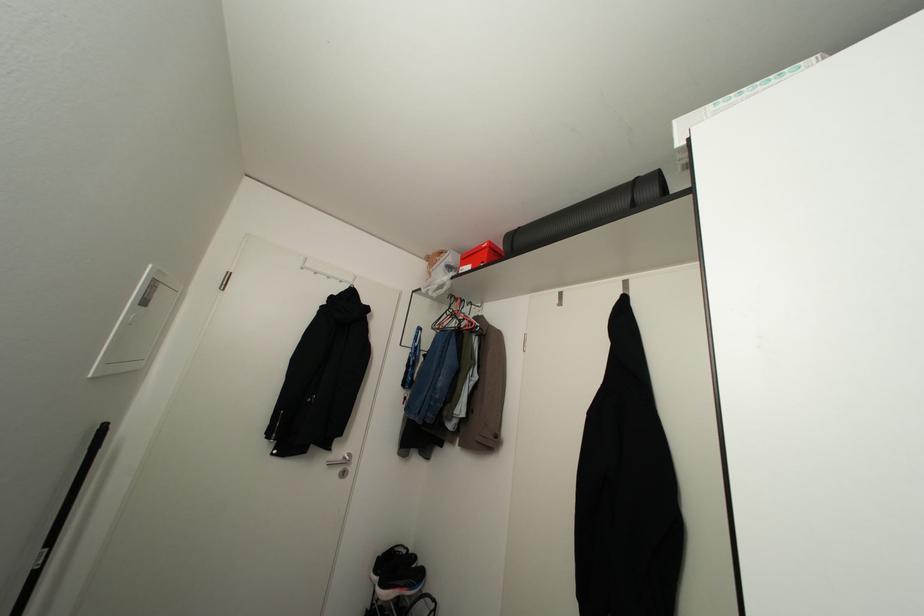
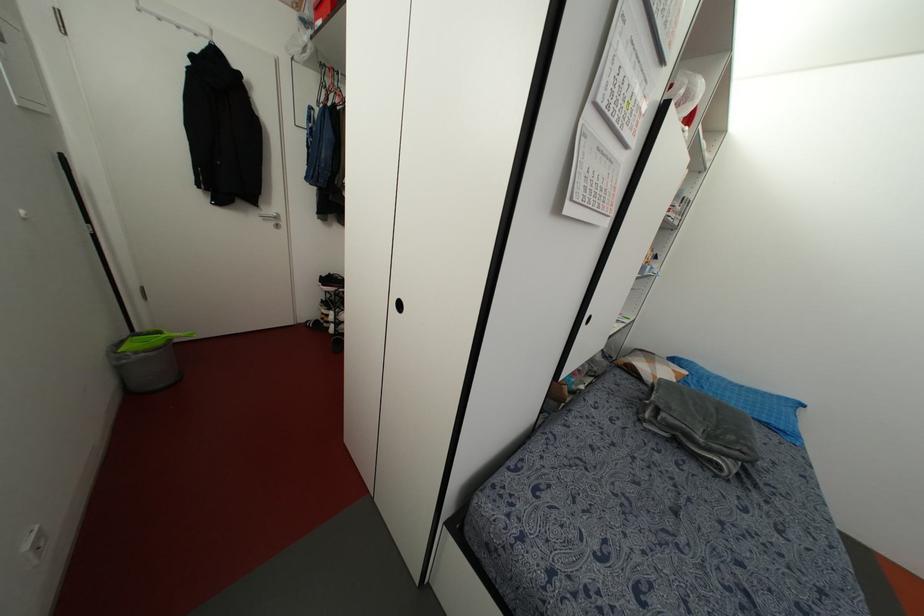
Find the pixel in the second image that matches pixel 451 294 in the first image.

(322, 63)